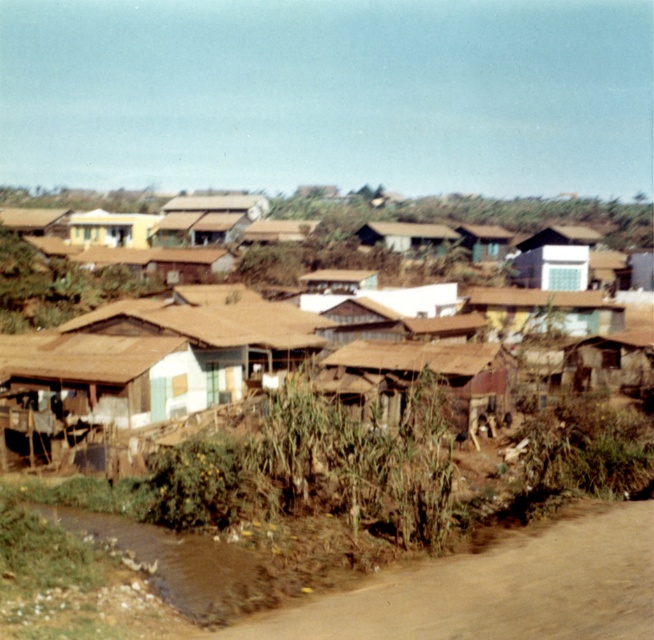
Can you confirm if brown thatched roof houses at center is positioned to the right of brown dirt track at lower right?

Incorrect, brown thatched roof houses at center is not on the right side of brown dirt track at lower right.

This screenshot has width=654, height=640. In order to click on brown thatched roof houses at center in this screenshot , I will do `click(468, 256)`.

What are the coordinates of `brown thatched roof houses at center` in the screenshot? It's located at (468, 256).

Find the location of a particular element. The height and width of the screenshot is (640, 654). brown thatched roof houses at center is located at coordinates (468, 256).

Is brown dirt track at lower right bigger than brown wooden hut at center?

Incorrect, brown dirt track at lower right is not larger than brown wooden hut at center.

Does brown dirt track at lower right appear on the right side of brown wooden hut at center?

Indeed, brown dirt track at lower right is positioned on the right side of brown wooden hut at center.

Where is `brown dirt track at lower right`? The height and width of the screenshot is (640, 654). brown dirt track at lower right is located at coordinates (494, 589).

Consider the image. Between brown dirt track at lower right and brown corrugated metal hut at center, which one is positioned higher?

brown corrugated metal hut at center

Is brown dirt track at lower right to the left of brown corrugated metal hut at center from the viewer's perspective?

Indeed, brown dirt track at lower right is positioned on the left side of brown corrugated metal hut at center.

The image size is (654, 640). In order to click on brown dirt track at lower right in this screenshot , I will do `click(494, 589)`.